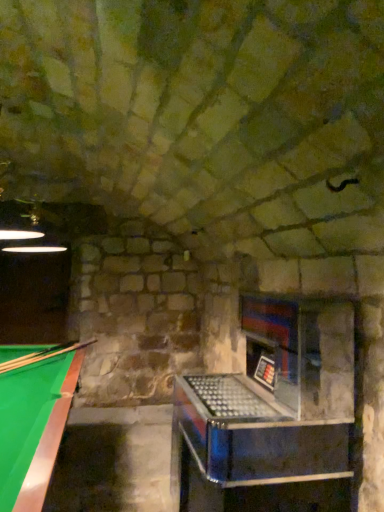
Describe the element at coordinates (33, 426) in the screenshot. The height and width of the screenshot is (512, 384). I see `green felt billiard table at lower left` at that location.

Image resolution: width=384 pixels, height=512 pixels. Find the location of `green felt billiard table at lower left`. green felt billiard table at lower left is located at coordinates (33, 426).

The width and height of the screenshot is (384, 512). Identify the location of wooden smooth cue at left. (43, 355).

The image size is (384, 512). What do you see at coordinates (43, 355) in the screenshot? I see `wooden smooth cue at left` at bounding box center [43, 355].

Where is `green felt billiard table at lower left`? The height and width of the screenshot is (512, 384). green felt billiard table at lower left is located at coordinates (33, 426).

In the scene shown: Does wooden smooth cue at left appear on the left side of green felt billiard table at lower left?

Incorrect, wooden smooth cue at left is not on the left side of green felt billiard table at lower left.

Is wooden smooth cue at left in front of green felt billiard table at lower left?

No, wooden smooth cue at left is further to the viewer.

Considering the points (43, 353) and (24, 394), which point is behind, point (43, 353) or point (24, 394)?

Point (43, 353)

From the image's perspective, would you say wooden smooth cue at left is positioned over green felt billiard table at lower left?

Yes, from the image's perspective, wooden smooth cue at left is on top of green felt billiard table at lower left.

From a real-world perspective, is wooden smooth cue at left above or below green felt billiard table at lower left?

wooden smooth cue at left is above green felt billiard table at lower left.

Looking at their sizes, would you say wooden smooth cue at left is wider or thinner than green felt billiard table at lower left?

Clearly, wooden smooth cue at left has more width compared to green felt billiard table at lower left.

Is wooden smooth cue at left shorter than green felt billiard table at lower left?

Yes.

In terms of size, does wooden smooth cue at left appear bigger or smaller than green felt billiard table at lower left?

Considering their sizes, wooden smooth cue at left takes up less space than green felt billiard table at lower left.

Which is correct: wooden smooth cue at left is inside green felt billiard table at lower left, or outside of it?

wooden smooth cue at left is enclosed within green felt billiard table at lower left.

Is wooden smooth cue at left beside green felt billiard table at lower left?

wooden smooth cue at left is not next to green felt billiard table at lower left, and they're not touching.

Is green felt billiard table at lower left at the back of wooden smooth cue at left?

Yes, wooden smooth cue at left's orientation is away from green felt billiard table at lower left.

Can you tell me how much wooden smooth cue at left and green felt billiard table at lower left differ in facing direction?

62.5 degrees separate the facing orientations of wooden smooth cue at left and green felt billiard table at lower left.

Locate an element on the screen. cue behind the green felt billiard table at lower left is located at coordinates (43, 355).

Which is more to the left, green felt billiard table at lower left or wooden smooth cue at left?

green felt billiard table at lower left is more to the left.

In the scene shown: Considering their positions, is green felt billiard table at lower left located in front of or behind wooden smooth cue at left?

In the image, green felt billiard table at lower left appears in front of wooden smooth cue at left.

Is point (16, 394) farther from viewer compared to point (56, 355)?

No, it is in front of (56, 355).

From the image's perspective, is green felt billiard table at lower left positioned above or below wooden smooth cue at left?

From the image's perspective, green felt billiard table at lower left appears below wooden smooth cue at left.

From a real-world perspective, is green felt billiard table at lower left above or below wooden smooth cue at left?

In terms of real-world spatial position, green felt billiard table at lower left is below wooden smooth cue at left.

In the scene shown: In terms of width, does green felt billiard table at lower left look wider or thinner when compared to wooden smooth cue at left?

Considering their sizes, green felt billiard table at lower left looks slimmer than wooden smooth cue at left.

Considering the relative sizes of green felt billiard table at lower left and wooden smooth cue at left in the image provided, is green felt billiard table at lower left taller than wooden smooth cue at left?

Correct, green felt billiard table at lower left is much taller as wooden smooth cue at left.

Between green felt billiard table at lower left and wooden smooth cue at left, which one has smaller size?

A: With smaller size is wooden smooth cue at left.

Would you say wooden smooth cue at left is part of green felt billiard table at lower left's contents?

Yes, wooden smooth cue at left is inside green felt billiard table at lower left.

Are green felt billiard table at lower left and wooden smooth cue at left making contact?

green felt billiard table at lower left is not next to wooden smooth cue at left, and they're not touching.

Is green felt billiard table at lower left looking in the opposite direction of wooden smooth cue at left?

No, wooden smooth cue at left is not at the back of green felt billiard table at lower left.

How different are the orientations of green felt billiard table at lower left and wooden smooth cue at left in degrees?

62.5 degrees.

Find the location of a particular element. The height and width of the screenshot is (512, 384). cue above the green felt billiard table at lower left (from a real-world perspective) is located at coordinates (43, 355).

Locate an element on the screen. billiard table in front of the wooden smooth cue at left is located at coordinates (33, 426).

Locate an element on the screen. The width and height of the screenshot is (384, 512). cue on the right side of green felt billiard table at lower left is located at coordinates (43, 355).